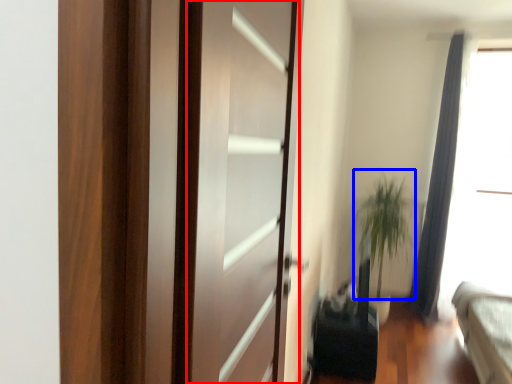
Question: Which object appears farthest to the camera in this image, screen door (highlighted by a red box) or plant (highlighted by a blue box)?

Choices:
 (A) screen door
 (B) plant

Answer: (B)